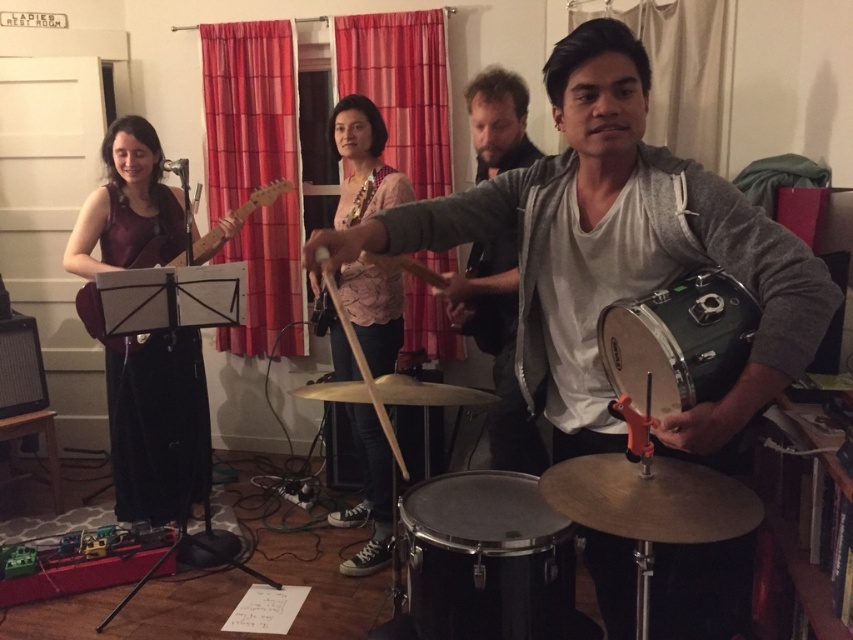
Is point (724, 189) positioned behind point (531, 164)?

No.

Is green drum at center below gray fabric jacket at center?

Yes, green drum at center is below gray fabric jacket at center.

Is point (668, 198) in front of point (474, 280)?

Yes, it is in front of point (474, 280).

Where is `green drum at center`? The image size is (853, 640). green drum at center is located at coordinates (616, 252).

Who is positioned more to the left, matte purple guitar at left or matte pink shirt at center?

matte purple guitar at left is more to the left.

Does matte purple guitar at left appear on the right side of matte pink shirt at center?

In fact, matte purple guitar at left is to the left of matte pink shirt at center.

Where is `matte purple guitar at left`? matte purple guitar at left is located at coordinates (157, 424).

Can you confirm if gray fabric jacket at center is bigger than matte wood guitar at left?

No, gray fabric jacket at center is not bigger than matte wood guitar at left.

Can you confirm if gray fabric jacket at center is shorter than matte wood guitar at left?

No.

Is point (509, 264) less distant than point (207, 243)?

Yes, point (509, 264) is closer to viewer.

Identify the location of gray fabric jacket at center. (497, 346).